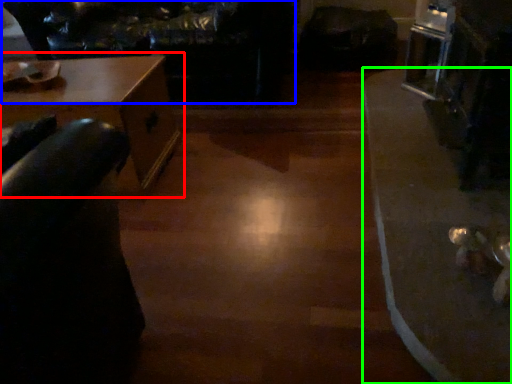
Question: Considering the real-world distances, which object is closest to table (highlighted by a red box)? couch (highlighted by a blue box) or table (highlighted by a green box).

Choices:
 (A) couch
 (B) table

Answer: (A)